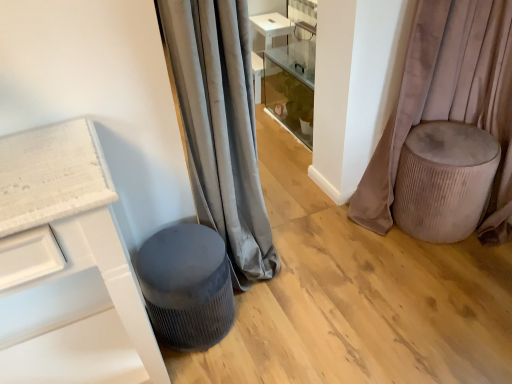
Where is `vacant region to the right of velvet grey stool at lower left`? vacant region to the right of velvet grey stool at lower left is located at coordinates (276, 327).